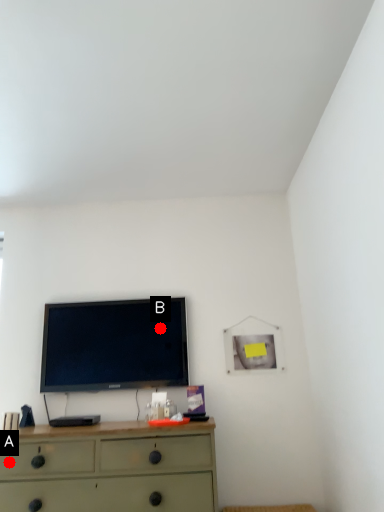
Question: Two points are circled on the image, labeled by A and B beside each circle. Which point is farther from the camera taking this photo?

Choices:
 (A) A is further
 (B) B is further

Answer: (B)